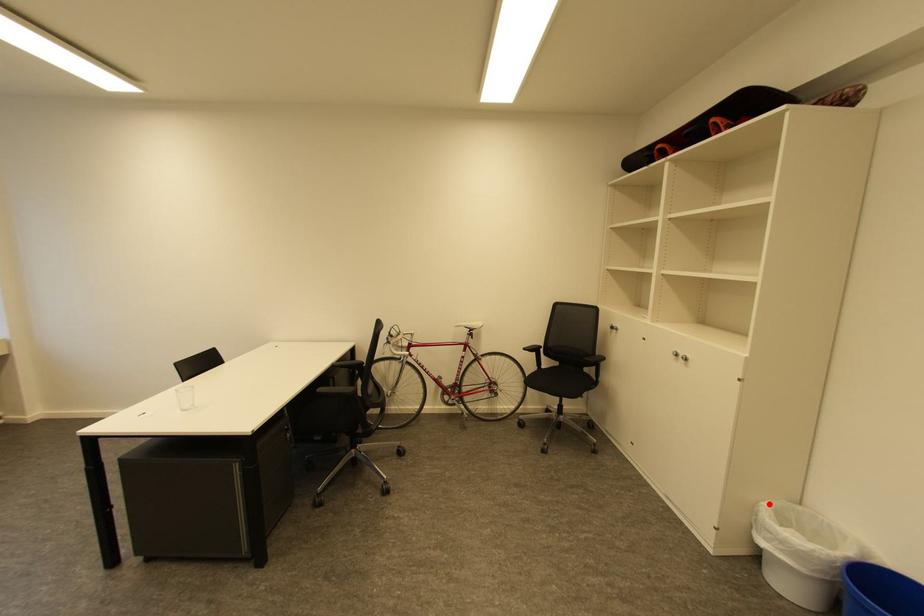
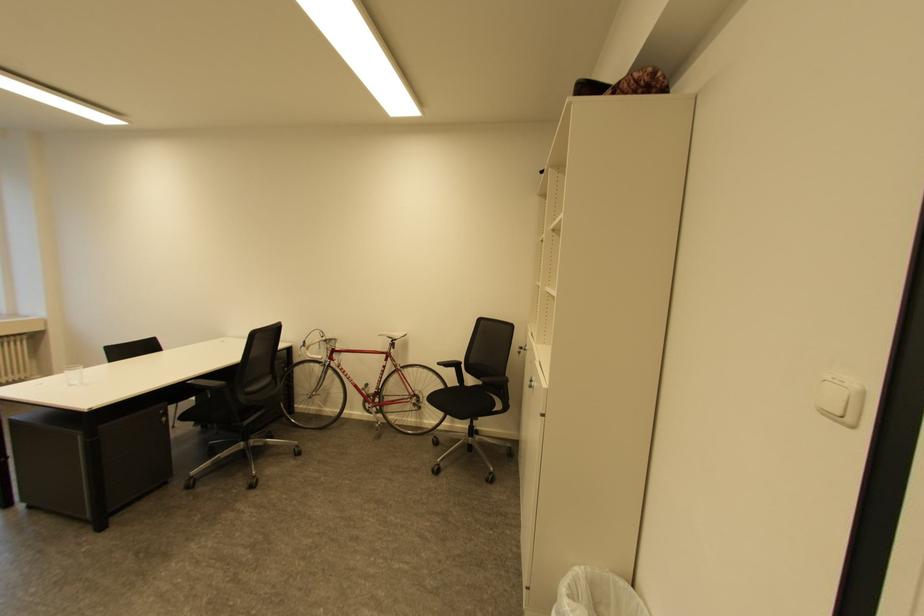
In the second image, find the point that corresponds to the highlighted location in the first image.

(579, 569)